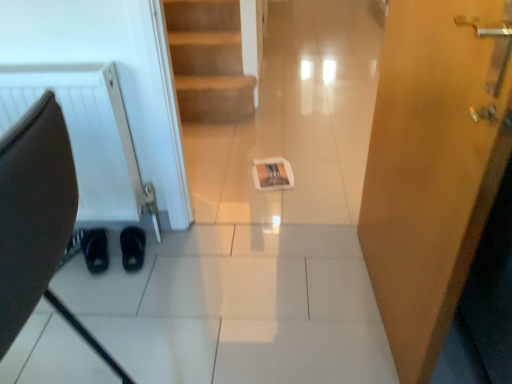
At what (x,y) coordinates should I click in order to perform the action: click on vacant area that is situated to the right of white textured radiator at left. Please return your answer as a coordinate pair (x, y). Looking at the image, I should click on (187, 247).